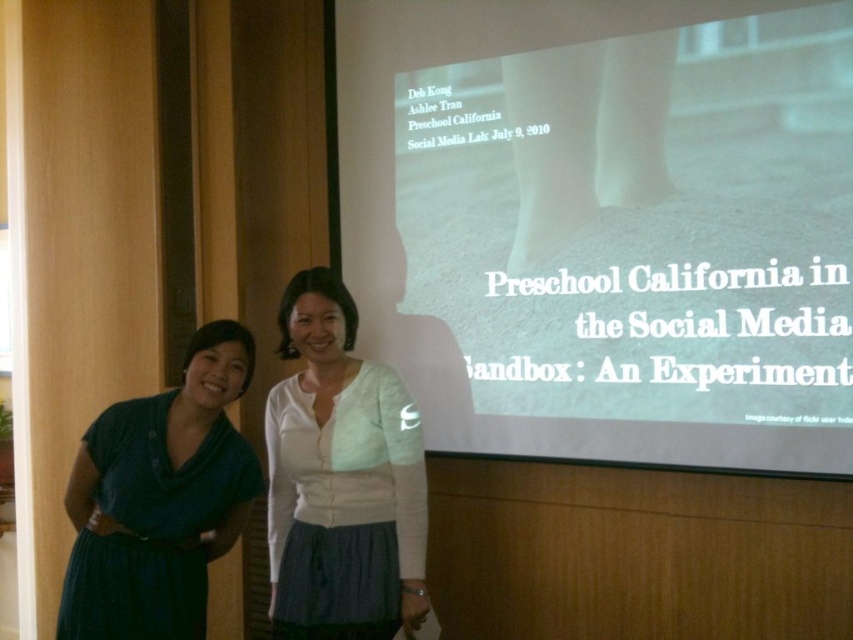
You are standing in the presentation area and need to place a small sticker on the projection screen. The sticker must be placed in front of the other point. Which coordinate point should you choose between point (x=769, y=436) and point (x=276, y=483)?

You should place the sticker on point (x=769, y=436) because it is in front of point (x=276, y=483) according to the spatial relationship provided.

You are a photographer setting up for a presentation. You need to ensure that the white matte blouse at center and the dark blue fabric dress at left are both visible in the frame. Based on their heights in the image, which one might require you to adjust the camera angle to capture fully?

The white matte blouse at center is taller than the dark blue fabric dress at left, so you might need to adjust the camera angle to capture the taller white matte blouse at center fully.

Based on the scene description, where is the white matte projection screen at upper center located in the image?

The white matte projection screen at upper center is located at the 2D coordinates point (606, 224).